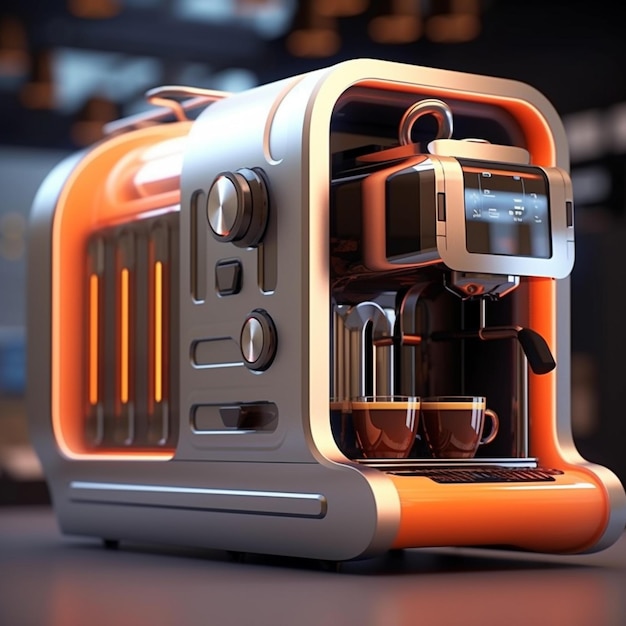
Where is `orange lights`? Image resolution: width=626 pixels, height=626 pixels. orange lights is located at coordinates (155, 359), (124, 365), (96, 370).